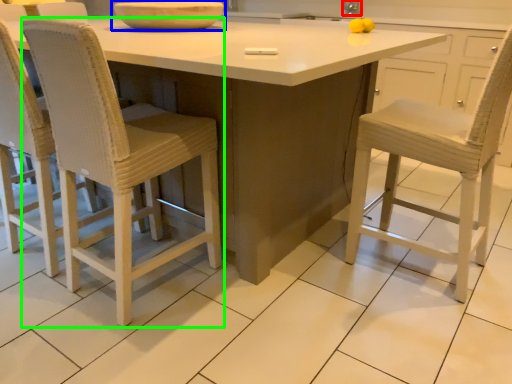
Question: Which object is the closest to the faucet (highlighted by a red box)? Choose among these: bowl (highlighted by a blue box) or chair (highlighted by a green box).

Choices:
 (A) bowl
 (B) chair

Answer: (A)